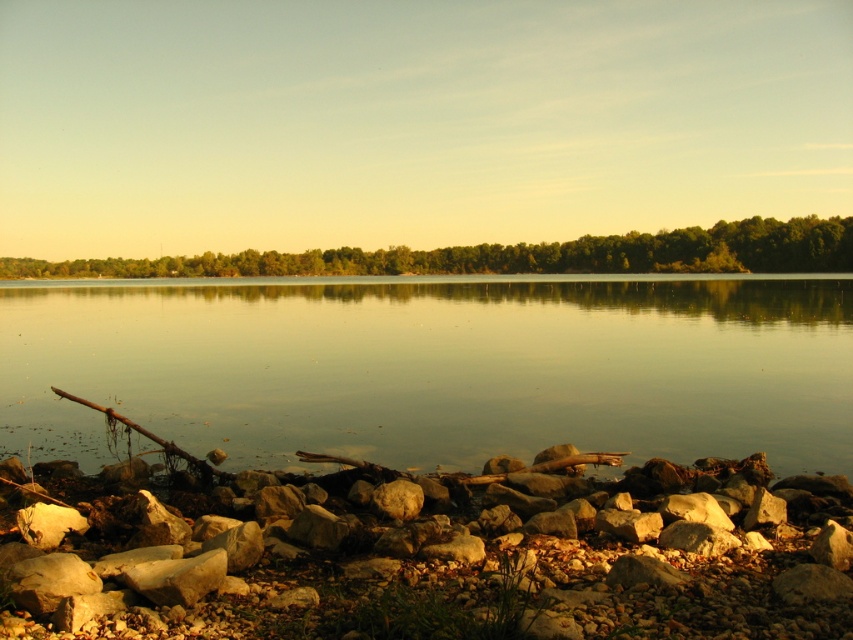
Question: Is clear water at center wider than green leafy trees at center?

Choices:
 (A) yes
 (B) no

Answer: (B)

Question: Among these objects, which one is nearest to the camera?

Choices:
 (A) smooth gray rock at lower center
 (B) clear water at center
 (C) green leafy trees at center

Answer: (A)

Question: Observing the image, what is the correct spatial positioning of clear water at center in reference to green leafy trees at center?

Choices:
 (A) right
 (B) left

Answer: (A)

Question: Which point is closer to the camera taking this photo?

Choices:
 (A) (512, 385)
 (B) (531, 588)
 (C) (357, 273)

Answer: (B)

Question: Which object is farther from the camera taking this photo?

Choices:
 (A) smooth gray rock at lower center
 (B) green leafy trees at center
 (C) clear water at center

Answer: (B)

Question: Observing the image, what is the correct spatial positioning of smooth gray rock at lower center in reference to green leafy trees at center?

Choices:
 (A) above
 (B) below

Answer: (B)